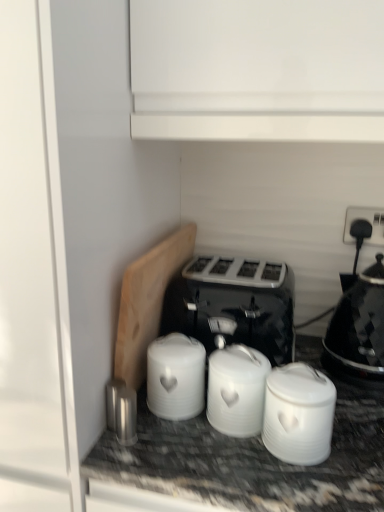
Question: From a real-world perspective, is white matte canisters at center, the second appliance positioned from the right, physically located above or below black glossy kettle at right?

Choices:
 (A) below
 (B) above

Answer: (A)

Question: In terms of width, does white matte canisters at center, the second appliance positioned from the right, look wider or thinner when compared to black glossy kettle at right?

Choices:
 (A) thin
 (B) wide

Answer: (A)

Question: Estimate the real-world distances between objects in this image. Which object is closer to the black glossy kettle at right?

Choices:
 (A) white matte jar at center, the 4th appliance when ordered from left to right
 (B) shiny metallic canister at lower center, placed as the 4th appliance when sorted from right to left
 (C) white matte canisters at center, which is the third appliance in left-to-right order
 (D) black plastic socket at upper right
 (E) black plastic toaster at center

Answer: (D)

Question: Based on their relative distances, which object is nearer to the white matte canisters at center, the second appliance positioned from the right?

Choices:
 (A) shiny metallic canister at lower center, positioned as the 1th appliance in left-to-right order
 (B) black plastic socket at upper right
 (C) white ceramic canister at center, the 3th appliance in the right-to-left sequence
 (D) white matte jar at center, the 4th appliance when ordered from left to right
 (E) black plastic toaster at center

Answer: (D)